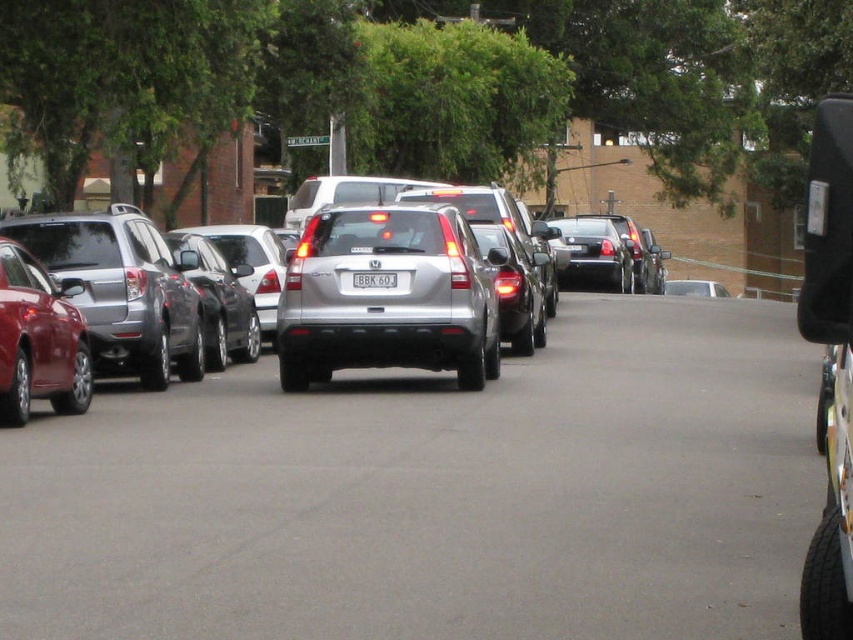
You are standing at the center of the street and see the shiny red sedan at left. Can you determine its exact location based on the coordinate provided?

The shiny red sedan at left is located at point coordinates of (39, 340).

You are a delivery driver who needs to park your vehicle between the shiny red sedan at left and the white plastic license plate at center. Is there enough space for your car, which is 4.5 meters long?

The shiny red sedan at left is to the left of the white plastic license plate at center. Since the distance between them isn not specified, it is impossible to determine if there is enough space for a 4.5 meter car.